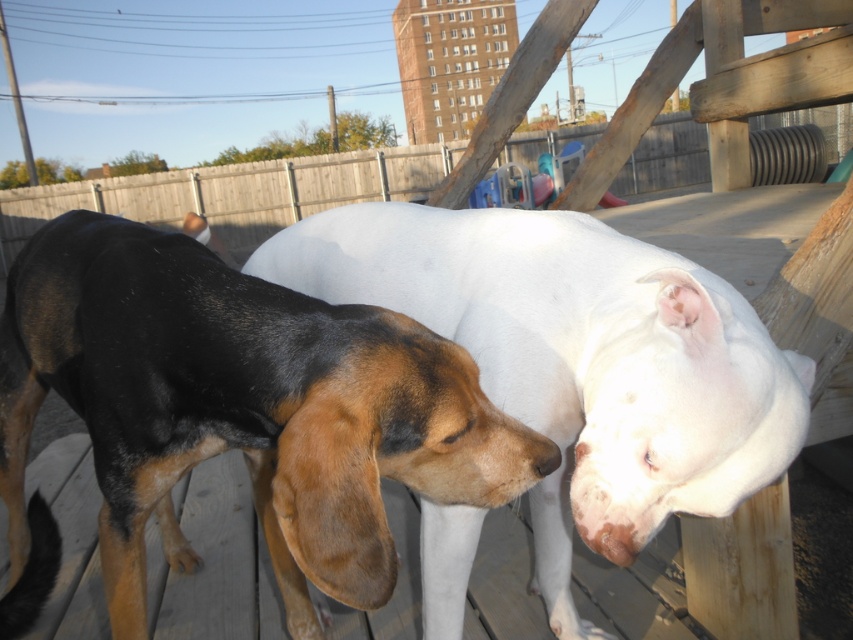
Question: Is brown and black fur dog at center thinner than white smooth dog at center?

Choices:
 (A) no
 (B) yes

Answer: (A)

Question: Does brown and black fur dog at center appear on the right side of white smooth dog at center?

Choices:
 (A) no
 (B) yes

Answer: (A)

Question: Which object appears farthest from the camera in this image?

Choices:
 (A) white smooth dog at center
 (B) brown and black fur dog at center

Answer: (A)

Question: Which object is farther from the camera taking this photo?

Choices:
 (A) white smooth dog at center
 (B) brown and black fur dog at center

Answer: (A)

Question: Is brown and black fur dog at center below white smooth dog at center?

Choices:
 (A) no
 (B) yes

Answer: (B)